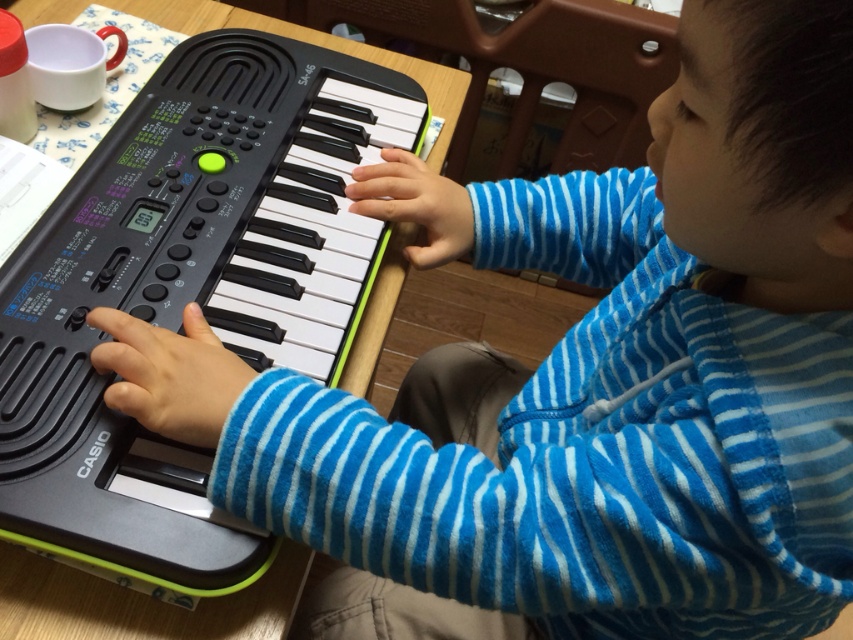
You are a music teacher observing a child playing the Casio keyboard. You notice the black plastic keyboard at center and the black matte keyboard key at center. Which object is taller?

The black plastic keyboard at center is taller than the black matte keyboard key at center.